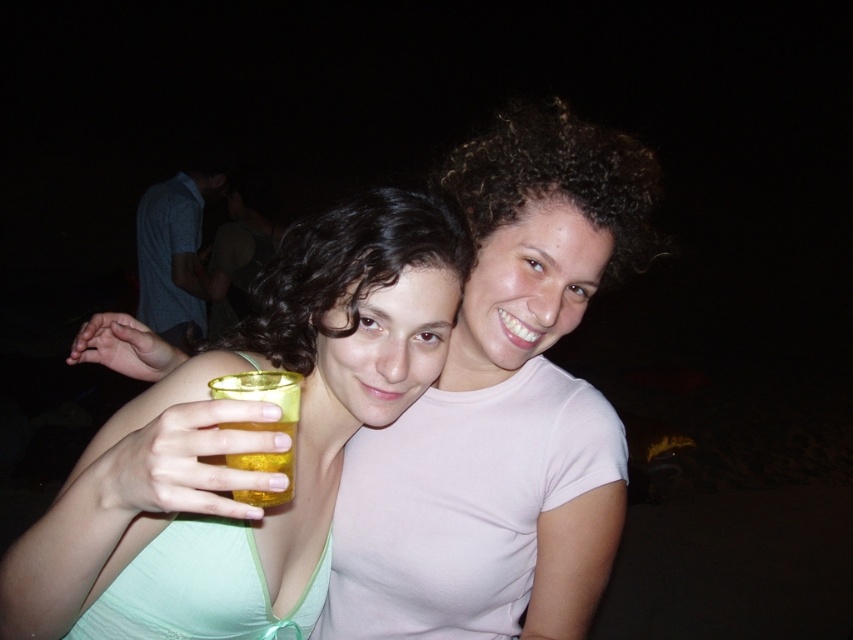
Between point (160, 225) and point (289, 467), which one is positioned in front?

Point (289, 467) is in front.

Is blue cotton shirt at upper left bigger than translucent yellow liquid at hand right?

Correct, blue cotton shirt at upper left is larger in size than translucent yellow liquid at hand right.

Is point (160, 294) positioned behind point (267, 385)?

Yes, point (160, 294) is farther from viewer.

What are the coordinates of `blue cotton shirt at upper left` in the screenshot? It's located at (175, 250).

Does translucent plastic cup at center have a lesser height compared to blue cotton shirt at upper left?

Yes.

I want to click on translucent plastic cup at center, so click(x=257, y=410).

Find the location of a particular element. translucent plastic cup at center is located at coordinates (257, 410).

Is matte pink shirt at center positioned in front of blue cotton shirt at upper left?

That is True.

Is matte pink shirt at center smaller than blue cotton shirt at upper left?

Yes, matte pink shirt at center is smaller than blue cotton shirt at upper left.

Does point (524, 564) lie behind point (215, 177)?

No, it is in front of (215, 177).

Where is `matte pink shirt at center`? This screenshot has width=853, height=640. matte pink shirt at center is located at coordinates (502, 408).